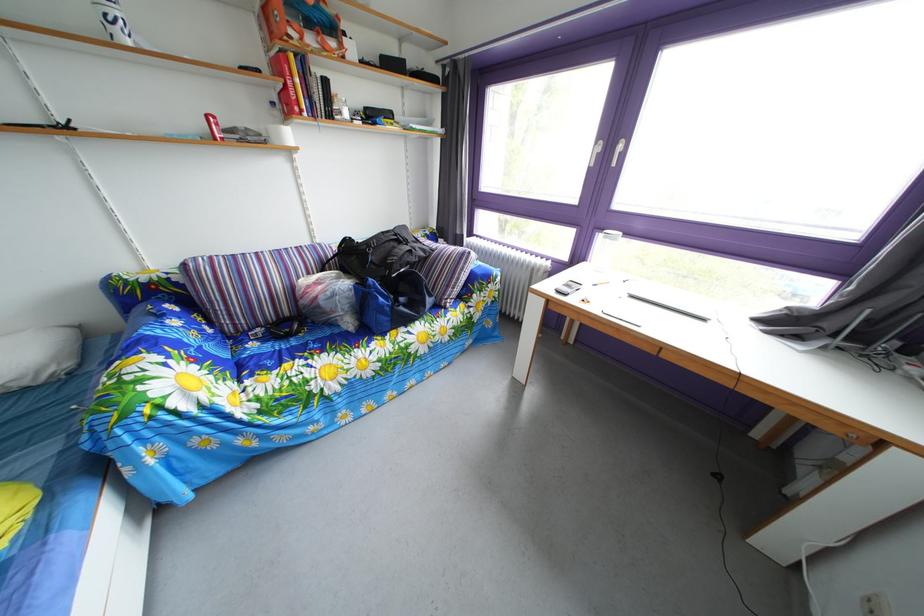
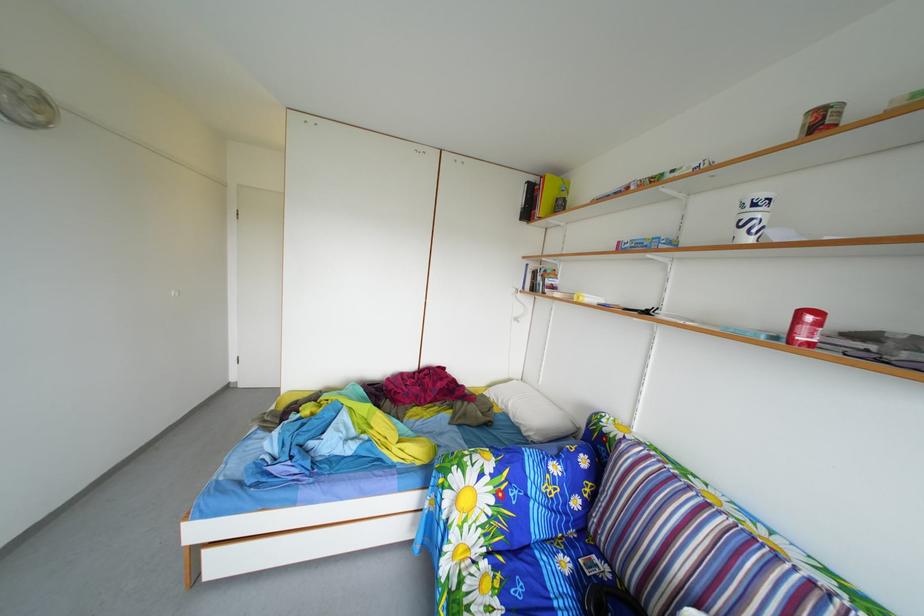
The point at (185, 419) is marked in the first image. Where is the corresponding point in the second image?

(453, 507)